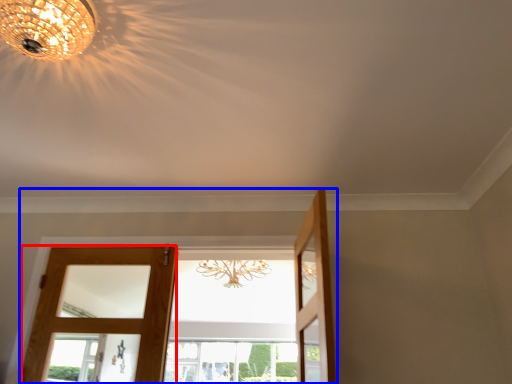
Question: Among these objects, which one is farthest to the camera, door (highlighted by a red box) or door (highlighted by a blue box)?

Choices:
 (A) door
 (B) door

Answer: (A)